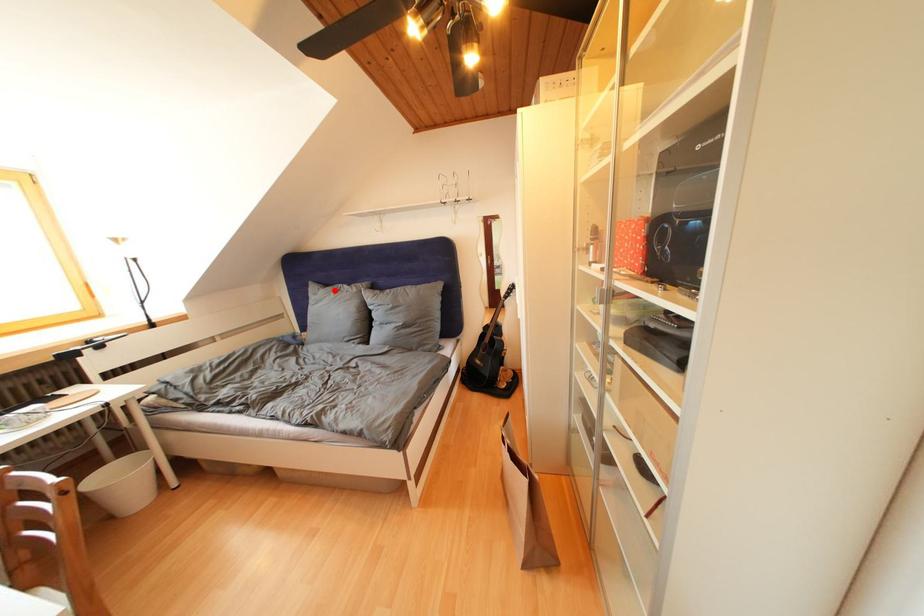
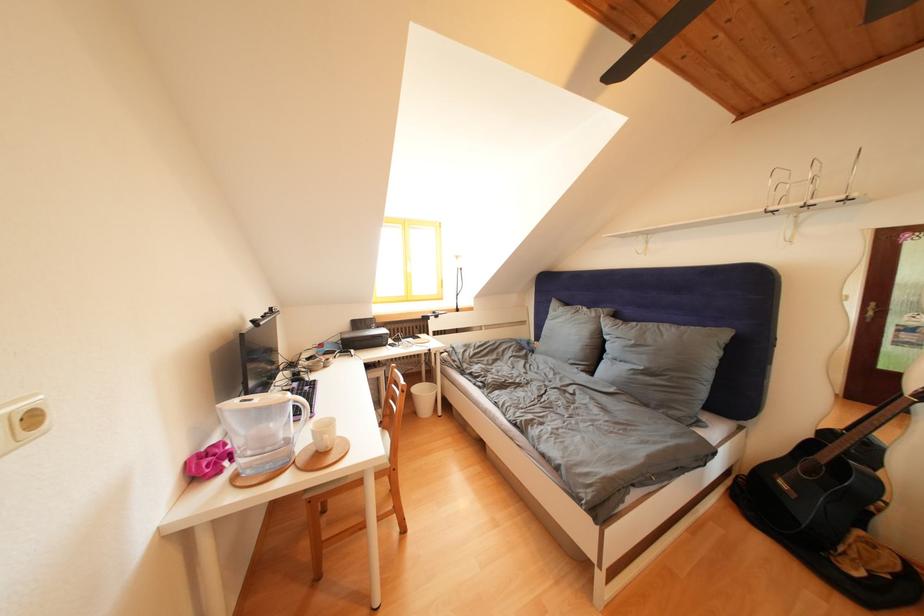
Locate, in the second image, the point that corresponds to the highlighted location in the first image.

(575, 310)